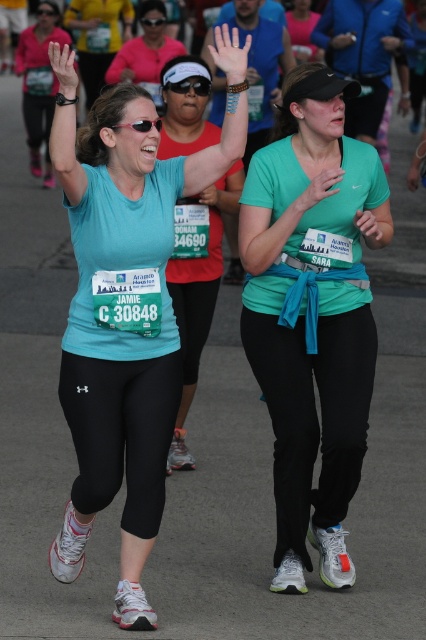
Who is lower down, matte green shirt at center or matte teal shirt at center?

matte green shirt at center is below.

You are a GUI agent. You are given a task and a screenshot of the screen. Output one action in this format:
    pyautogui.click(x=<x>, y=<y>)
    Task: Click on the matte green shirt at center
    The height and width of the screenshot is (640, 426).
    Given the screenshot: What is the action you would take?
    pyautogui.click(x=313, y=314)

Locate an element on the screen. The image size is (426, 640). matte green shirt at center is located at coordinates (313, 314).

Find the location of a particular element. This screenshot has height=640, width=426. matte green shirt at center is located at coordinates (313, 314).

Who is more distant from viewer, (x=112, y=364) or (x=120, y=77)?

Positioned behind is point (x=120, y=77).

Between point (155, 364) and point (123, 54), which one is positioned in front?

Point (155, 364) is in front.

Based on the photo, who is more forward, [121,257] or [137,80]?

Point [121,257]

The width and height of the screenshot is (426, 640). I want to click on matte blue shirt at center, so [124, 308].

Is matte blue shirt at center thinner than matte green shirt at center?

In fact, matte blue shirt at center might be wider than matte green shirt at center.

Who is positioned more to the left, matte blue shirt at center or matte green shirt at center?

From the viewer's perspective, matte blue shirt at center appears more on the left side.

Find the location of `matte blue shirt at center`. matte blue shirt at center is located at coordinates (124, 308).

Identify the location of matte blue shirt at center. (124, 308).